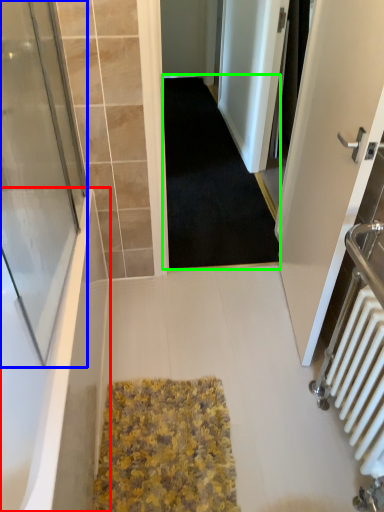
Question: Considering the real-world distances, which object is farthest from bathtub (highlighted by a red box)? screen door (highlighted by a blue box) or doormat (highlighted by a green box)?

Choices:
 (A) screen door
 (B) doormat

Answer: (B)